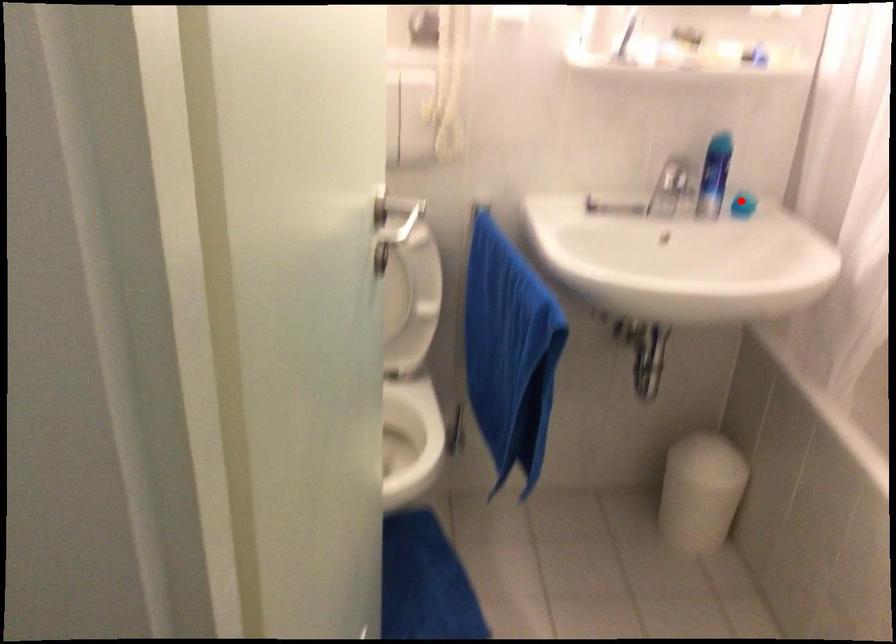
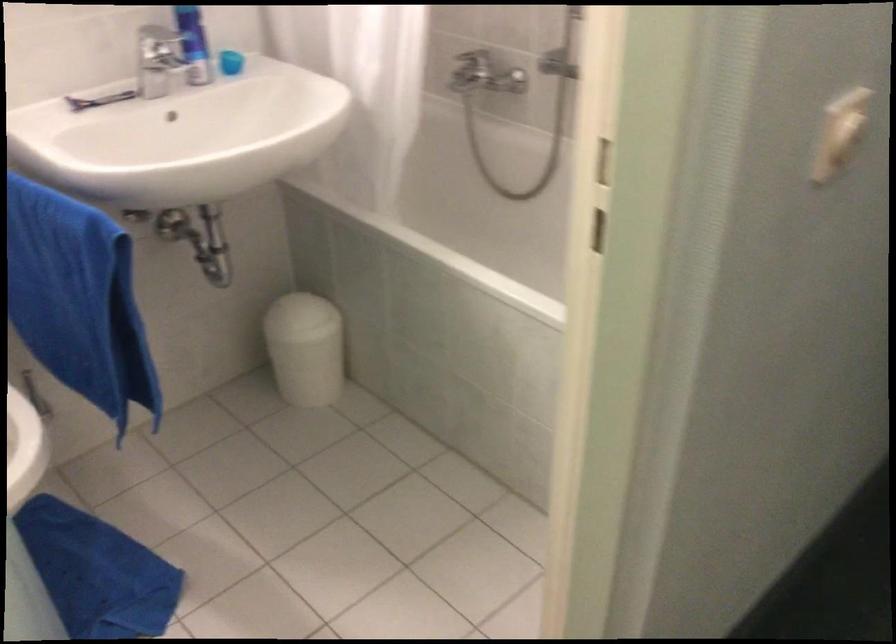
Find the pixel in the second image that matches the highlighted location in the first image.

(230, 62)